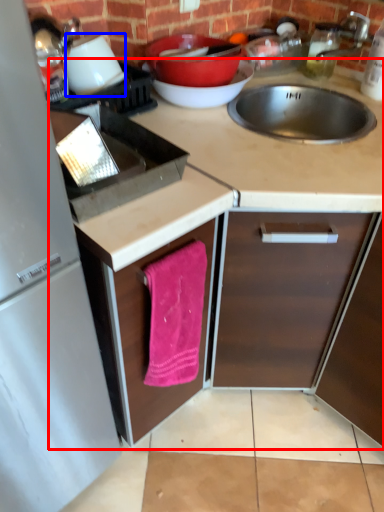
Question: Which of the following is the closest to the observer, countertop (highlighted by a red box) or appliance (highlighted by a blue box)?

Choices:
 (A) countertop
 (B) appliance

Answer: (A)